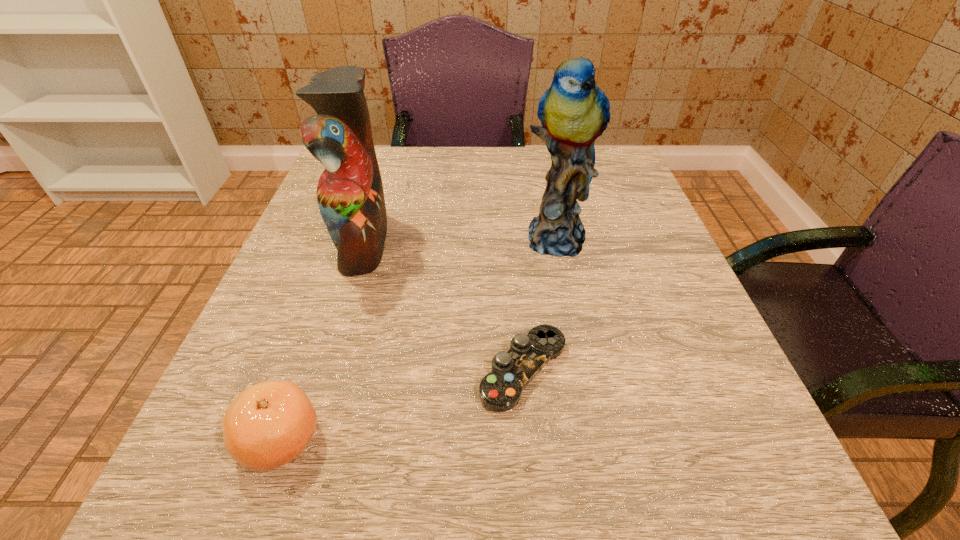
Image resolution: width=960 pixels, height=540 pixels. Find the location of `the right parrot`. the right parrot is located at coordinates (574, 112).

Image resolution: width=960 pixels, height=540 pixels. In order to click on the taller parrot in this screenshot , I will do `click(574, 112)`.

Where is `the shorter parrot`? Image resolution: width=960 pixels, height=540 pixels. the shorter parrot is located at coordinates (350, 196).

Locate an element on the screen. This screenshot has width=960, height=540. the left parrot is located at coordinates (350, 196).

This screenshot has height=540, width=960. I want to click on clementine, so click(x=269, y=424).

Identify the location of control. Image resolution: width=960 pixels, height=540 pixels. (500, 390).

This screenshot has width=960, height=540. Find the location of `vacant space located on the face of the taller parrot`. vacant space located on the face of the taller parrot is located at coordinates (573, 319).

Where is `free space located 0.230m at the face of the left parrot`? This screenshot has width=960, height=540. free space located 0.230m at the face of the left parrot is located at coordinates (505, 241).

Identify the location of free space located 0.370m on the back of the clementine. The height and width of the screenshot is (540, 960). (350, 238).

Find the location of `vacant space located on the left of the shortest object`. vacant space located on the left of the shortest object is located at coordinates [405, 370].